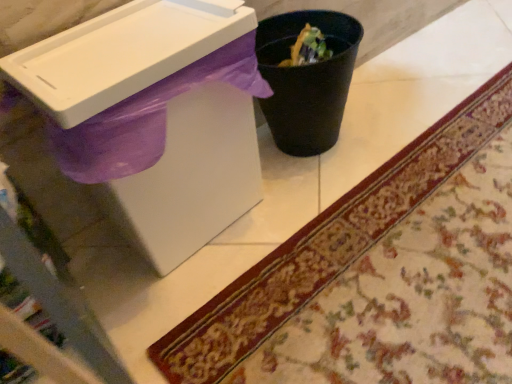
The image size is (512, 384). In order to click on free space in front of black plastic trash can at center in this screenshot , I will do `click(350, 193)`.